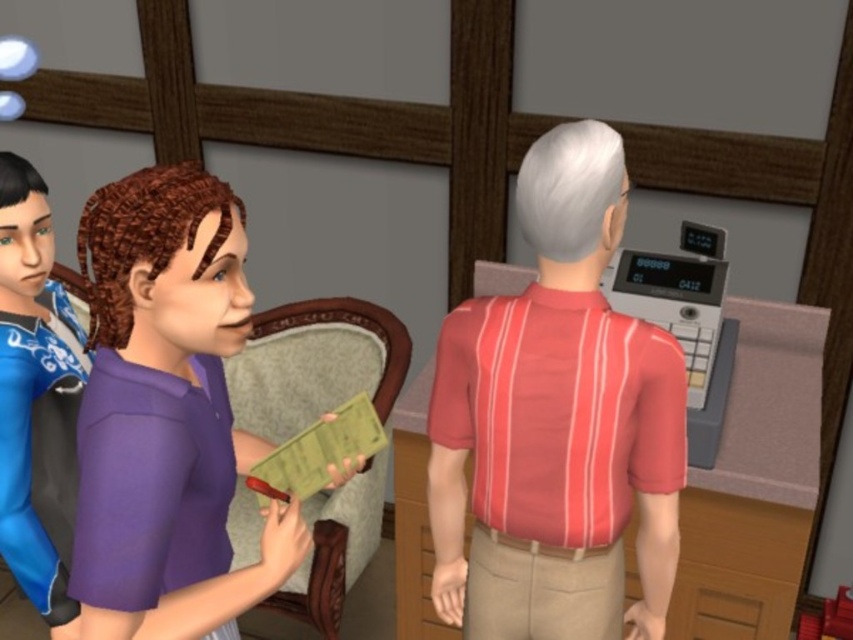
In the scene from The Sims, there is a red striped shirt at center and a velvet upholstered chair at center left. Which object is positioned higher in the image?

The red striped shirt at center is positioned higher than the velvet upholstered chair at center left.

You are a delivery robot that needs to deliver a package to the point marked at coordinates (218, 452) in the scene. The robot has a maximum reach of 1.2 meters. Can you reach the point from your current position?

The point marked at coordinates (218, 452) is 1.18 meters away from the camera, so yes, the delivery robot can reach it since its maximum reach of 1.2 meters exceeds the distance.

You are playing The Sims and need to place a new object at coordinate point 0.662, 0.654. Is there already an object at that location? Please check the red striped shirt at center.

The red striped shirt at center is located at point (556, 422), so yes, there is already an object at that coordinate.